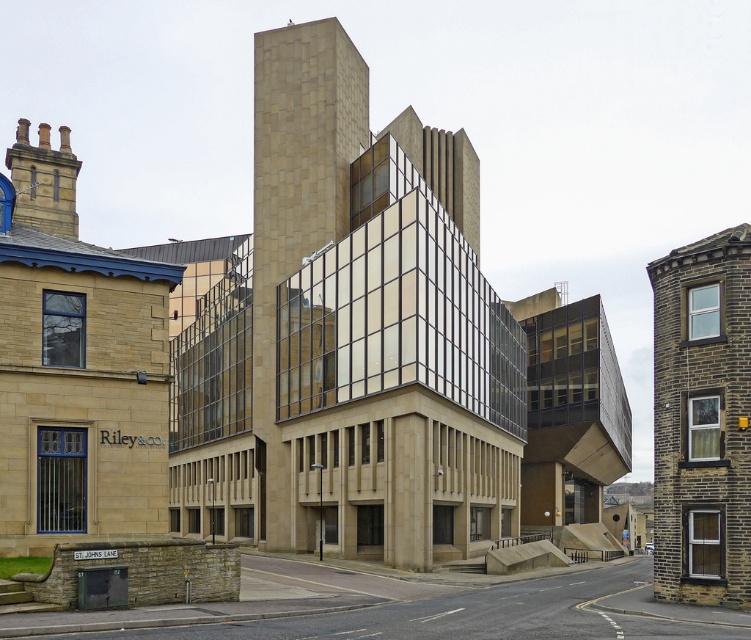
Which is below, beige stone tower at center or brown stone tower at right?

brown stone tower at right is lower down.

Is the position of beige stone tower at center less distant than that of brown stone tower at right?

That is False.

At what (x,y) coordinates should I click in order to perform the action: click on beige stone tower at center. Please return your answer as a coordinate pair (x, y). This screenshot has width=751, height=640. Looking at the image, I should click on click(348, 337).